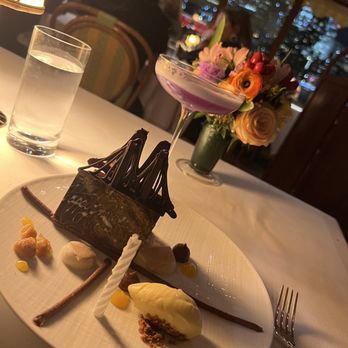
The image size is (348, 348). I want to click on fork, so click(287, 321).